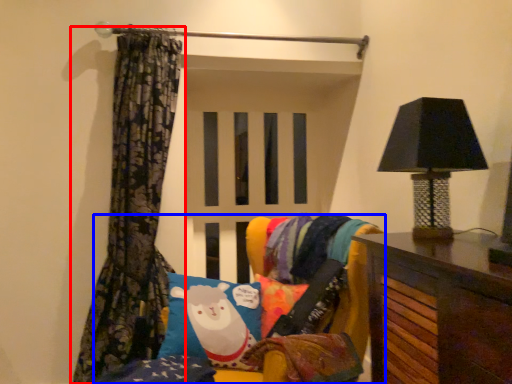
Question: Which of the following is the farthest to the observer, curtain (highlighted by a red box) or furniture (highlighted by a blue box)?

Choices:
 (A) curtain
 (B) furniture

Answer: (A)